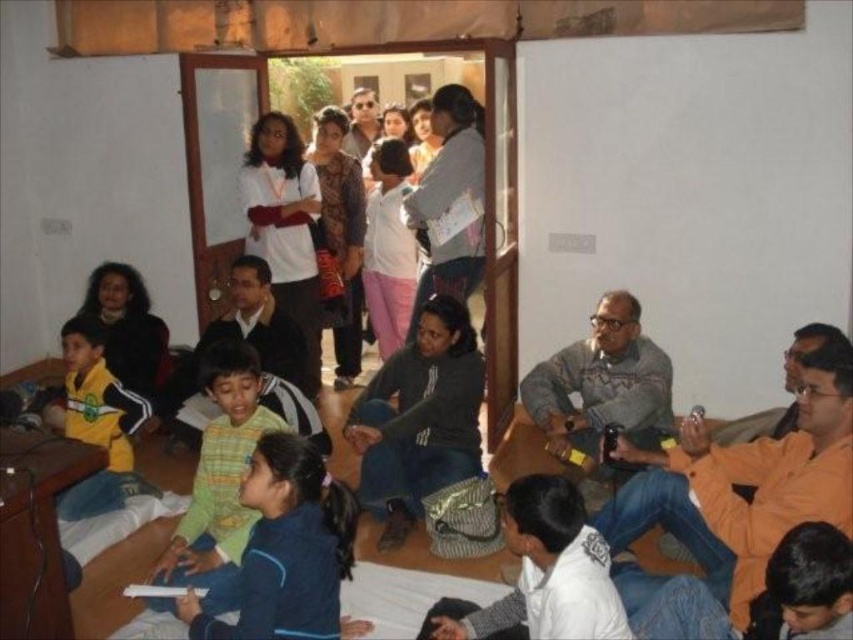
You are standing in the room and want to pick up the blue fleece jacket at lower left and the yellow jersey at left. Which one do you need to reach for first without moving your position?

The blue fleece jacket at lower left is closer to the viewer, so you should reach for it first before the yellow jersey at left.

You are standing in the room and want to take a photo of the dark gray fabric jacket at center. You have a camera that has a maximum range of 3 meters. Can you take the photo without moving closer?

The dark gray fabric jacket at center and camera are 3.31 meters apart from each other. Since the camera has a maximum range of 3 meters, you cannot take the photo without moving closer because the distance is greater than the camera can handle.